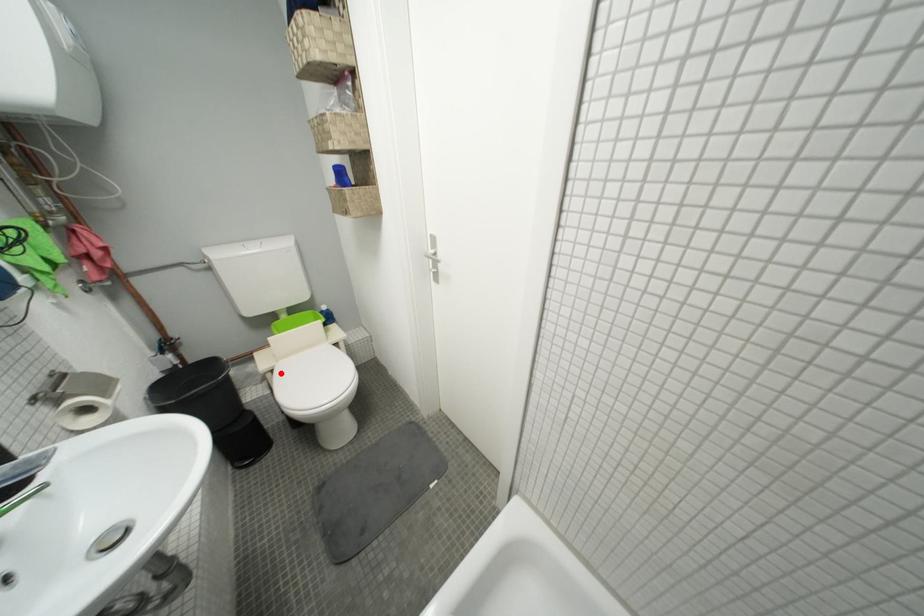
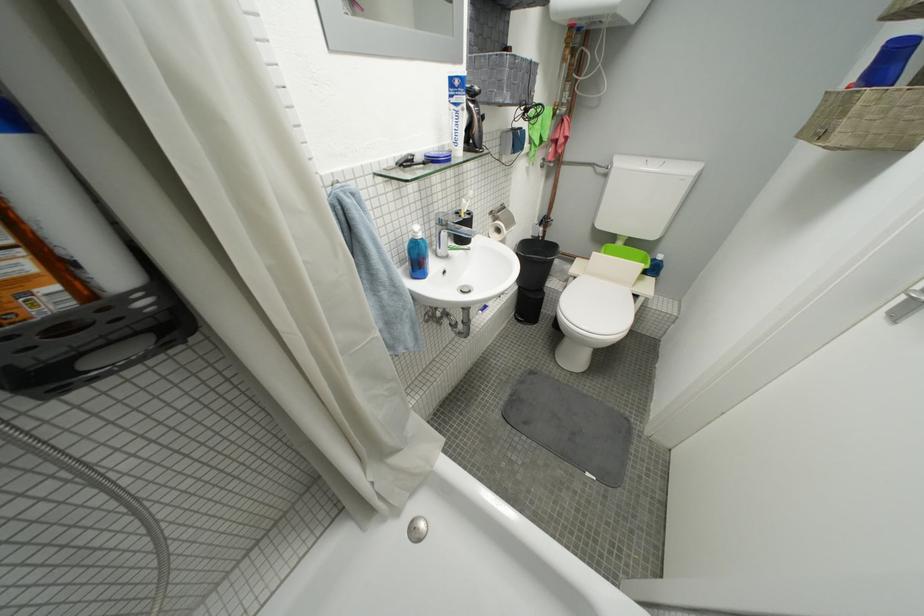
Question: I am providing you with two images of the same scene from different viewpoints. Given a red point in image1, look at the same physical point in image2. Is it:

Choices:
 (A) Closer to the viewpoint
 (B) Farther from the viewpoint

Answer: (A)